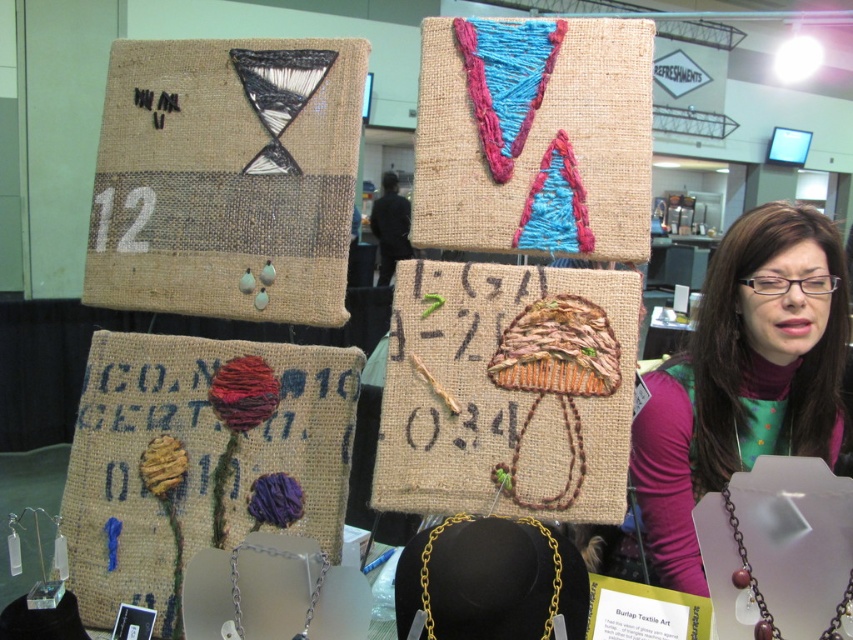
Question: Can you confirm if black fabric person at center is bigger than silver metallic chain at lower center?

Choices:
 (A) no
 (B) yes

Answer: (B)

Question: Which of these objects is positioned closest to the silver metallic chain at lower center?

Choices:
 (A) matte brown necklace at lower right
 (B) matte black necklace at lower right
 (C) black fabric person at center
 (D) gold chain necklace at center

Answer: (D)

Question: Which of these objects is positioned closest to the gold chain necklace at center?

Choices:
 (A) matte brown necklace at lower right
 (B) silver metallic chain at lower center

Answer: (B)

Question: Can you confirm if matte black necklace at lower right is positioned below black fabric person at center?

Choices:
 (A) yes
 (B) no

Answer: (A)

Question: Which object is positioned farthest from the matte brown necklace at lower right?

Choices:
 (A) gold chain necklace at center
 (B) silver metallic chain at lower center
 (C) black fabric person at center

Answer: (C)

Question: Does matte brown necklace at lower right lie behind gold chain necklace at center?

Choices:
 (A) no
 (B) yes

Answer: (A)